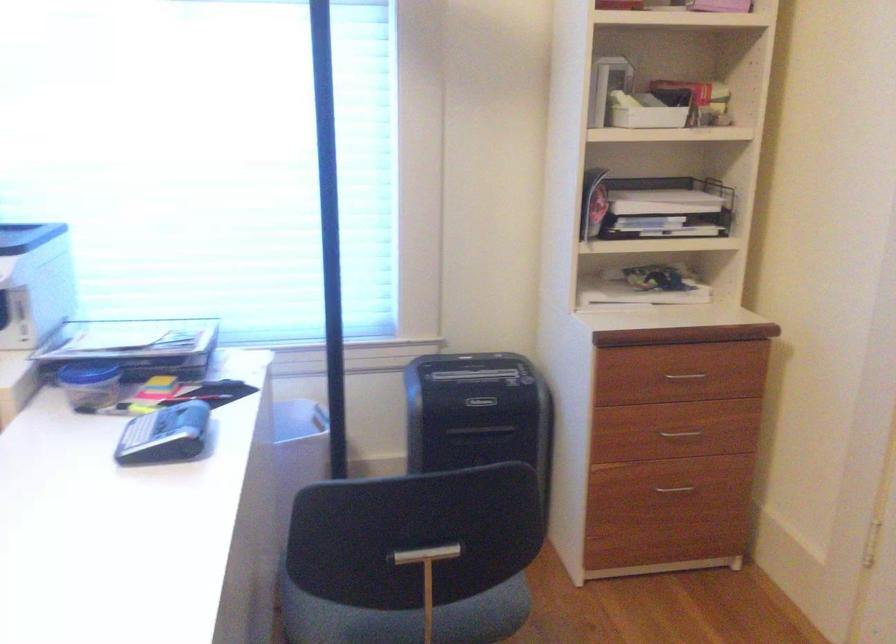
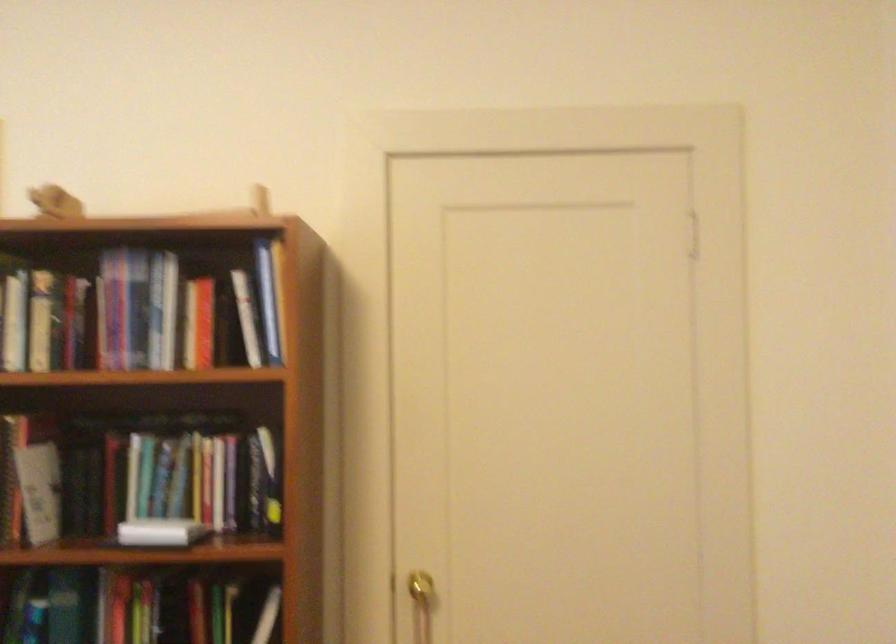
Question: The camera is either moving clockwise (left) or counter-clockwise (right) around the object. The first image is from the beginning of the video and the second image is from the end. Is the camera moving left or right when shooting the video?

Choices:
 (A) Left
 (B) Right

Answer: (A)